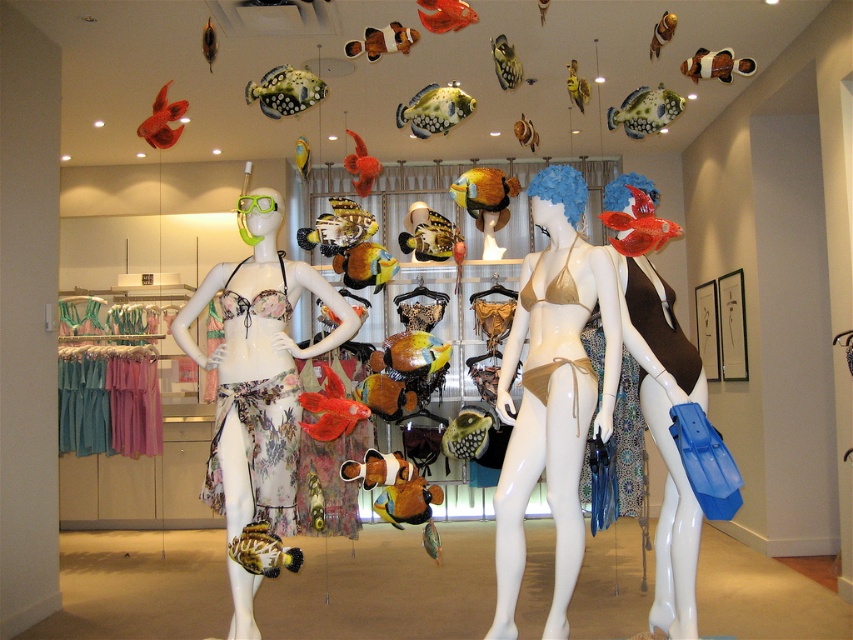
Question: Is the position of gold bikini at center more distant than that of matte gold bikini top at center?

Choices:
 (A) no
 (B) yes

Answer: (A)

Question: Which of the following is the closest to the observer?

Choices:
 (A) (520, 438)
 (B) (460, 285)
 (C) (259, 292)
 (D) (630, 349)

Answer: (A)

Question: Does gold bikini at center lie behind floral fabric bikini top at left?

Choices:
 (A) yes
 (B) no

Answer: (A)

Question: Which object appears closest to the camera in this image?

Choices:
 (A) matte gold bikini top at center
 (B) matte brown swimsuit at center
 (C) floral fabric bikini top at left

Answer: (C)

Question: Observing the image, what is the correct spatial positioning of floral fabric bikini top at left in reference to matte brown swimsuit at center?

Choices:
 (A) right
 (B) left

Answer: (B)

Question: Estimate the real-world distances between objects in this image. Which object is closer to the gold bikini at center?

Choices:
 (A) matte brown swimsuit at center
 (B) floral fabric bikini top at left

Answer: (A)